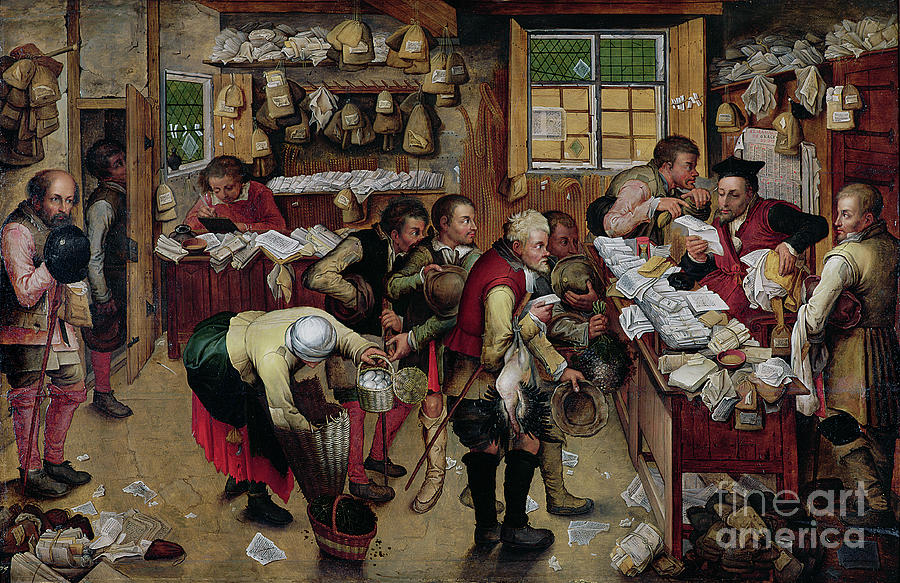
Find the location of `2 windows`. 2 windows is located at coordinates (562, 112), (210, 110).